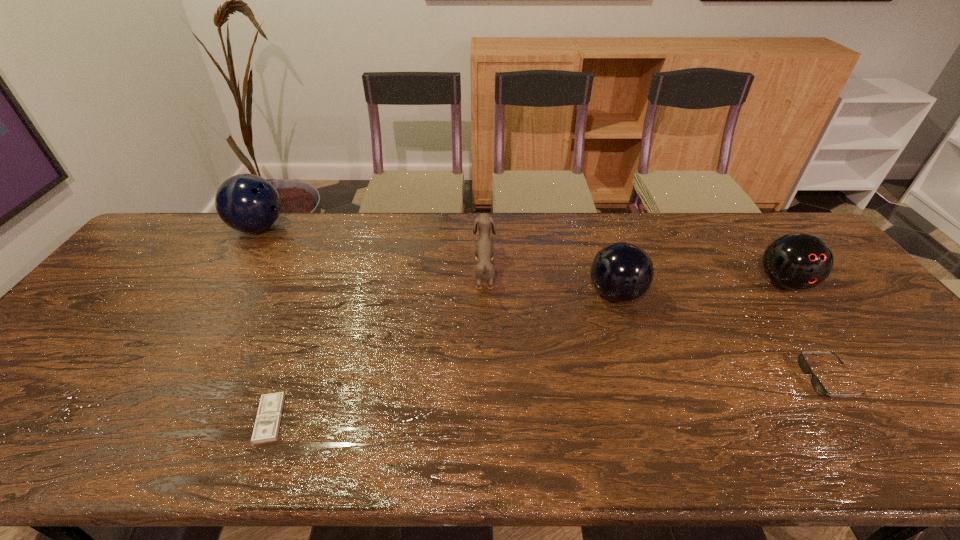
Identify the location of bowling ball located in the far edge section of the desktop. This screenshot has width=960, height=540. (248, 203).

The image size is (960, 540). I want to click on puppy present at the far edge, so click(x=484, y=249).

The width and height of the screenshot is (960, 540). I want to click on object that is positioned at the near edge, so click(268, 418).

What are the coordinates of `object that is at the right edge` in the screenshot? It's located at [797, 261].

This screenshot has height=540, width=960. Find the location of `free region at the far edge of the desktop`. free region at the far edge of the desktop is located at coordinates (541, 230).

The image size is (960, 540). Find the location of `vacant space at the right edge of the desktop`. vacant space at the right edge of the desktop is located at coordinates (902, 362).

In the image, there is a desktop. Find the location of `vacant space at the near left corner`. vacant space at the near left corner is located at coordinates (32, 429).

In order to click on vacant space at the far right corner in this screenshot , I will do `click(789, 224)`.

The height and width of the screenshot is (540, 960). In order to click on empty space between the puppy and the leftmost object in this screenshot , I will do `click(372, 249)`.

You are a GUI agent. You are given a task and a screenshot of the screen. Output one action in this format:
    pyautogui.click(x=<x>, y=<y>)
    Task: Click on the free point between the leftmost bowling ball and the money
    The image size is (960, 540).
    Given the screenshot: What is the action you would take?
    pyautogui.click(x=264, y=323)